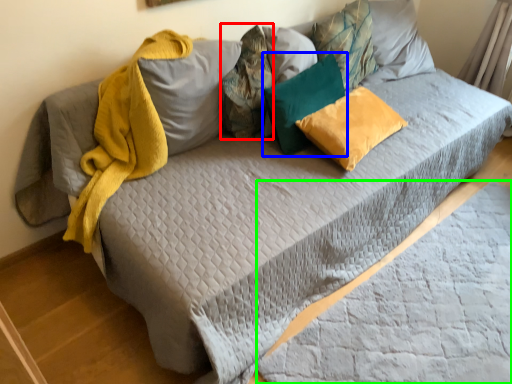
Question: Considering the real-world distances, which object is farthest from pillow (highlighted by a red box)? pillow (highlighted by a blue box) or sheet (highlighted by a green box)?

Choices:
 (A) pillow
 (B) sheet

Answer: (B)